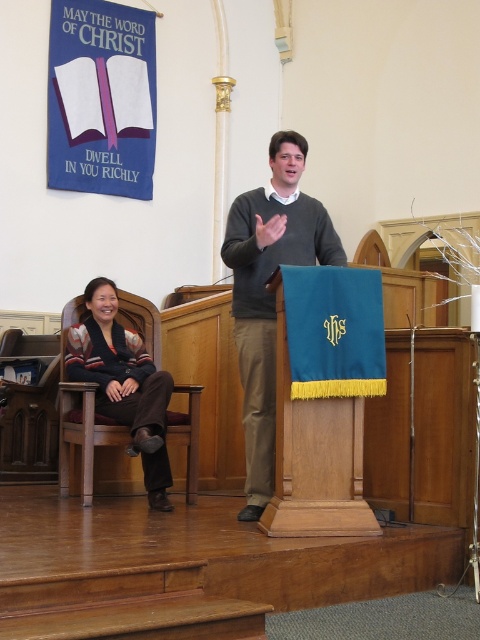
Question: Where is dark gray sweater at center located in relation to knit sweater at lower left in the image?

Choices:
 (A) below
 (B) above

Answer: (B)

Question: Which point is farther from the camera taking this photo?

Choices:
 (A) pos(256,227)
 (B) pos(139,403)

Answer: (B)

Question: Can you confirm if dark gray sweater at center is wider than knit sweater at lower left?

Choices:
 (A) yes
 (B) no

Answer: (B)

Question: Can you confirm if dark gray sweater at center is positioned to the right of knit sweater at lower left?

Choices:
 (A) yes
 (B) no

Answer: (A)